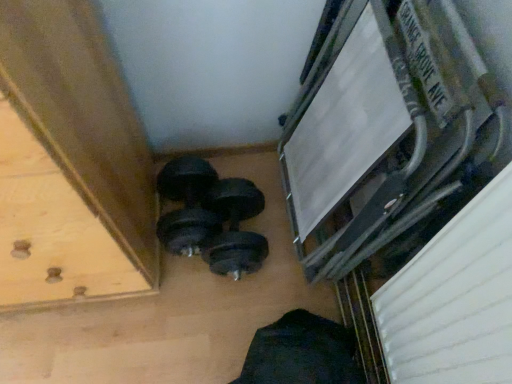
Where is `vacant area that is situated to the right of black rubber dumbbell at center, the 1th dumbbell viewed from the right`? The width and height of the screenshot is (512, 384). vacant area that is situated to the right of black rubber dumbbell at center, the 1th dumbbell viewed from the right is located at coordinates (286, 244).